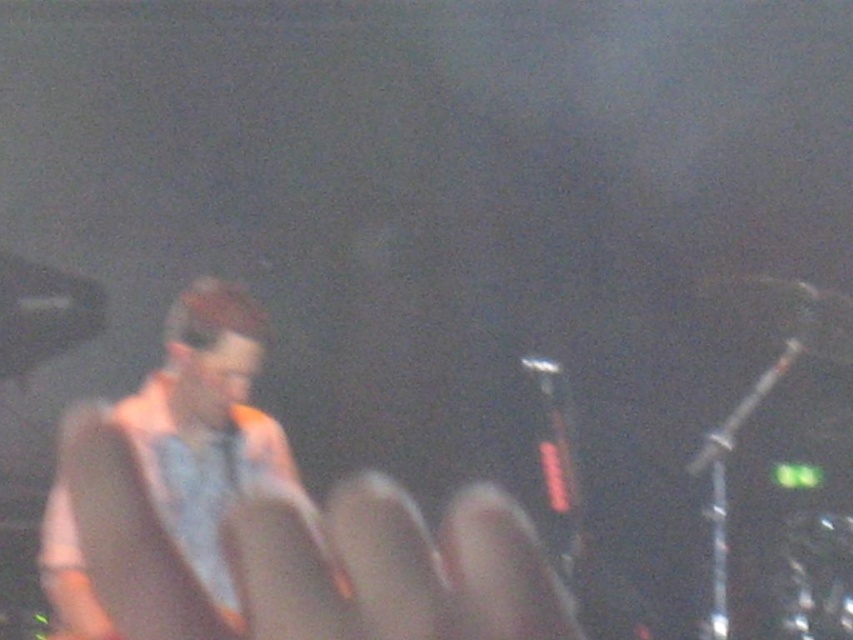
Question: Is matte gray hand at center further to the viewer compared to light brown leather jacket at left?

Choices:
 (A) no
 (B) yes

Answer: (A)

Question: Which point appears closest to the camera in this image?

Choices:
 (A) (550, 582)
 (B) (210, 412)

Answer: (A)

Question: Among these objects, which one is nearest to the camera?

Choices:
 (A) matte gray hand at center
 (B) light brown leather jacket at left

Answer: (A)

Question: Does matte gray hand at center appear on the right side of light brown leather jacket at left?

Choices:
 (A) yes
 (B) no

Answer: (A)

Question: Does matte gray hand at center come in front of light brown leather jacket at left?

Choices:
 (A) no
 (B) yes

Answer: (B)